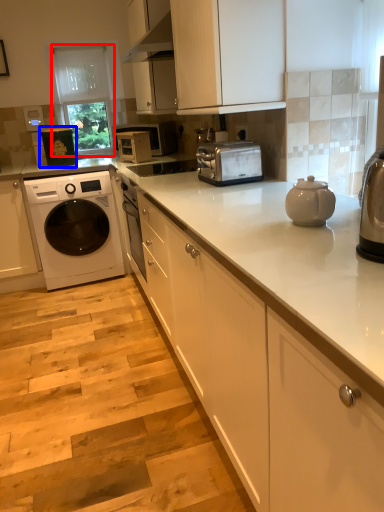
Question: Which object is closer to the camera taking this photo, glass door (highlighted by a red box) or appliance (highlighted by a blue box)?

Choices:
 (A) glass door
 (B) appliance

Answer: (B)